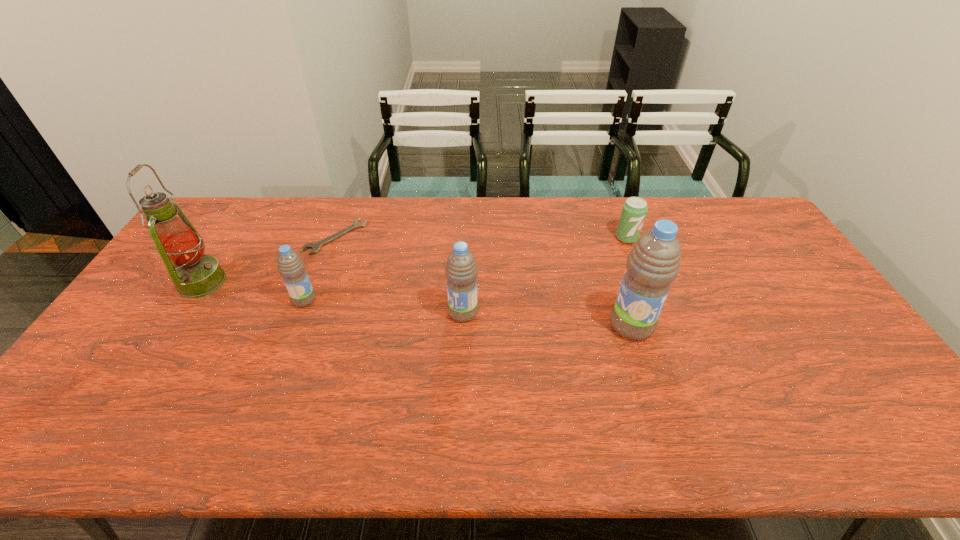
The width and height of the screenshot is (960, 540). Find the location of `the third closest water bottle to the shortest object`. the third closest water bottle to the shortest object is located at coordinates [x=653, y=264].

The height and width of the screenshot is (540, 960). Find the location of `water bottle identified as the closest to the shortest water bottle`. water bottle identified as the closest to the shortest water bottle is located at coordinates (461, 270).

Where is `free space that satisfies the following two spatial constraints: 1. on the back side of the second shortest object; 2. on the right side of the rightmost water bottle`? Image resolution: width=960 pixels, height=540 pixels. free space that satisfies the following two spatial constraints: 1. on the back side of the second shortest object; 2. on the right side of the rightmost water bottle is located at coordinates (603, 238).

Image resolution: width=960 pixels, height=540 pixels. Find the location of `vacant point that satisfies the following two spatial constraints: 1. on the front side of the third shortest object; 2. on the right side of the leftmost object`. vacant point that satisfies the following two spatial constraints: 1. on the front side of the third shortest object; 2. on the right side of the leftmost object is located at coordinates (191, 300).